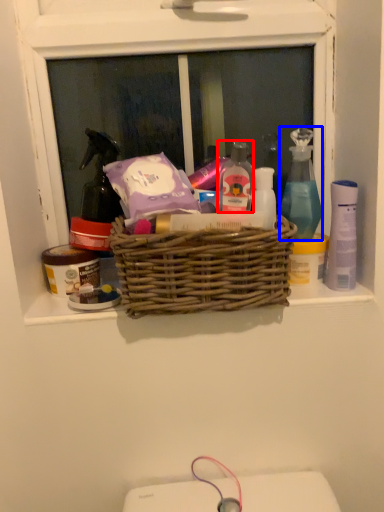
Question: Which point is further to the camera, toiletry (highlighted by a red box) or cleaning product (highlighted by a blue box)?

Choices:
 (A) toiletry
 (B) cleaning product

Answer: (B)